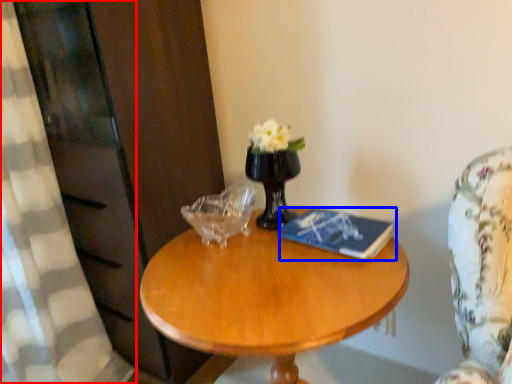
Question: Which object is closer to the camera taking this photo, curtain (highlighted by a red box) or book (highlighted by a blue box)?

Choices:
 (A) curtain
 (B) book

Answer: (A)